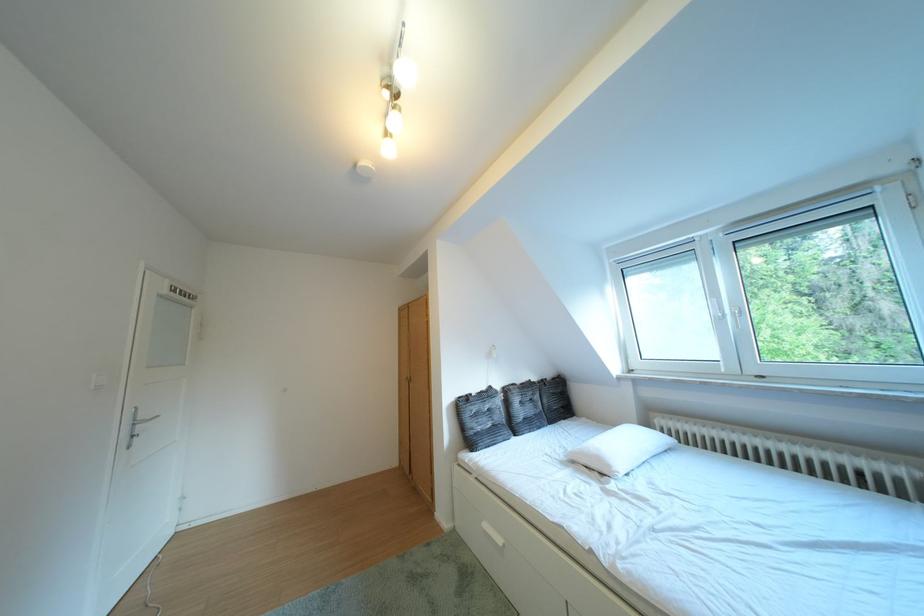
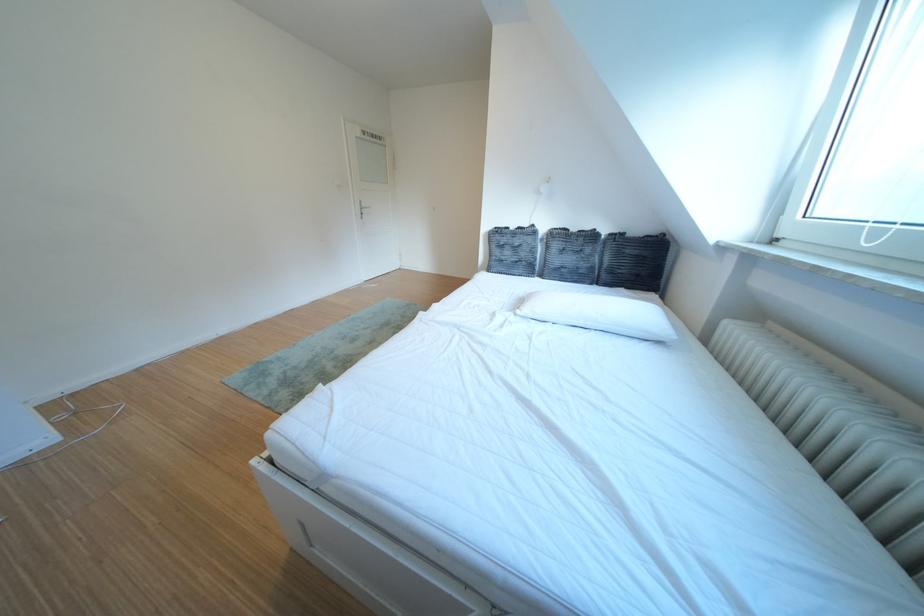
In the second image, find the point that corresponds to point (634, 474) in the first image.

(540, 314)